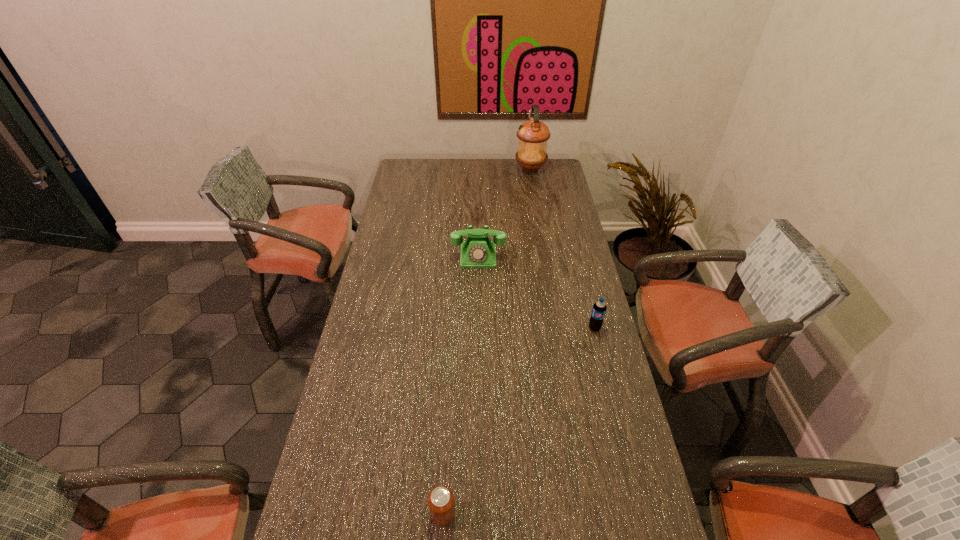
I want to click on free area in between the second object from right to left and the rightmost object, so click(x=563, y=248).

Identify the location of empty space between the rightmost object and the third object from left to right. (563, 248).

At what (x,y) coordinates should I click in order to perform the action: click on vacant region between the second nearest object and the second farthest object. Please return your answer as a coordinate pair (x, y). Looking at the image, I should click on tap(537, 292).

What are the coordinates of `empty space that is in between the farthest object and the can` in the screenshot? It's located at (487, 341).

At what (x,y) coordinates should I click in order to perform the action: click on unoccupied area between the tallest object and the third farthest object. Please return your answer as a coordinate pair (x, y). This screenshot has width=960, height=540. Looking at the image, I should click on (563, 248).

This screenshot has height=540, width=960. What are the coordinates of `vacant area between the nearest object and the rightmost object` in the screenshot? It's located at (518, 421).

Find the location of `empty space that is in between the second object from right to left and the second nearest object`. empty space that is in between the second object from right to left and the second nearest object is located at coordinates (563, 248).

The width and height of the screenshot is (960, 540). I want to click on free spot between the nearest object and the soda bottle, so click(x=518, y=421).

Identify which object is the second nearest to the tallest object. Please provide its 2D coordinates. Your answer should be formatted as a tuple, i.e. [(x, y)], where the tuple contains the x and y coordinates of a point satisfying the conditions above.

[(599, 308)]

The height and width of the screenshot is (540, 960). I want to click on object that is the third closest to the shortest object, so click(x=533, y=135).